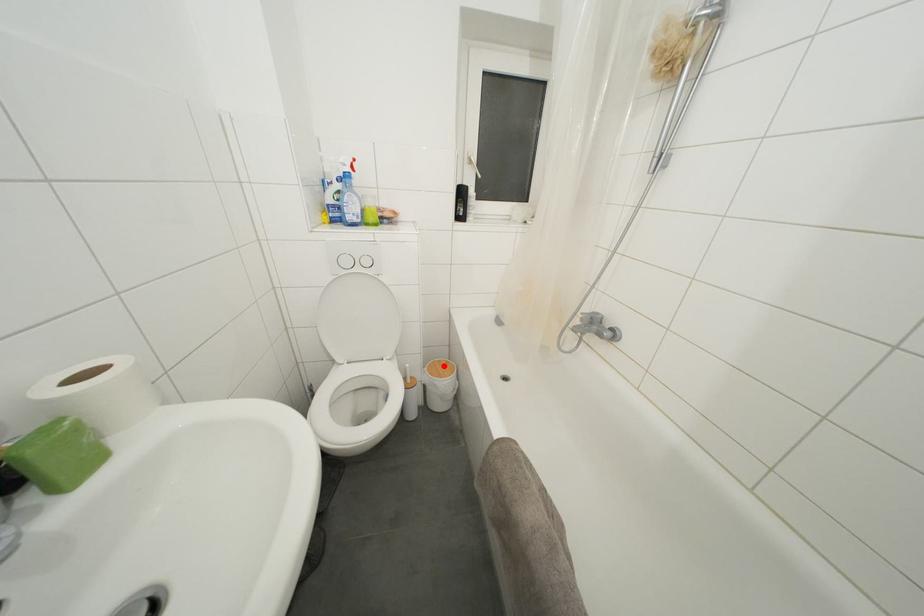
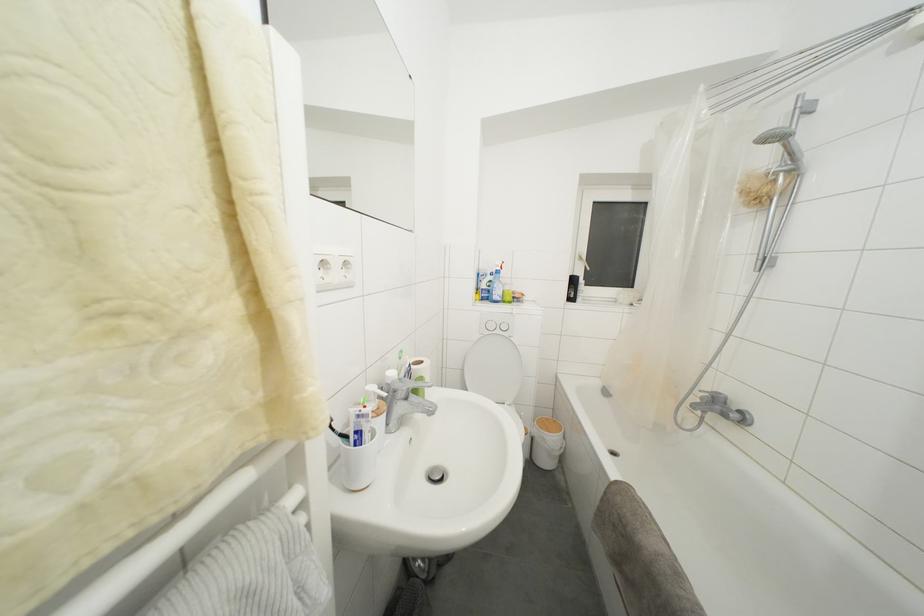
Question: I am providing you with two images of the same scene from different viewpoints. In image1, a red point is highlighted. Considering the same 3D point in image2, which of the following is correct?

Choices:
 (A) It is closer
 (B) It is farther

Answer: (B)